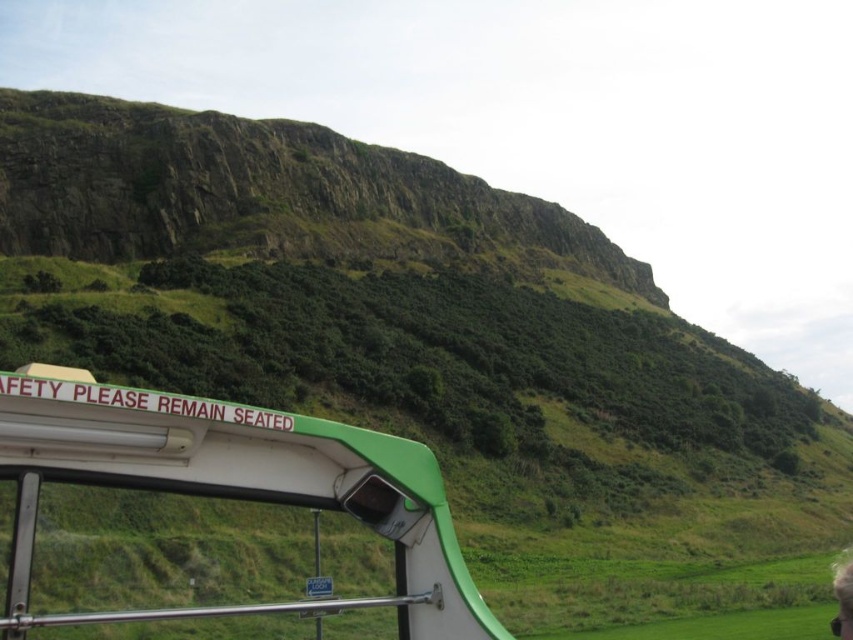
You are a passenger on the green plastic tour bus at lower left and want to wave to the smooth skin person at lower right who is standing nearby. Can you easily see them from your current position?

The green plastic tour bus at lower left is closer to the viewer than the smooth skin person at lower right, so the bus might block your view. You might not be able to easily see them.

You are a passenger on the green plastic tour bus at lower left and want to stand up to stretch your legs. Considering the height of the bus compared to the smooth skin person at lower right, do you think there is enough headroom for you to stand comfortably?

The green plastic tour bus at lower left is much taller than the smooth skin person at lower right, so there should be sufficient headroom for you to stand comfortably inside the bus.

You are a tour guide standing on the grassy hill. You see the green plastic tour bus at lower left and the smooth skin person at lower right. Which object is closer to you?

The smooth skin person at lower right is closer to you because the green plastic tour bus at lower left is 20.38 meters away from them, meaning the bus is further away from your position on the hill.